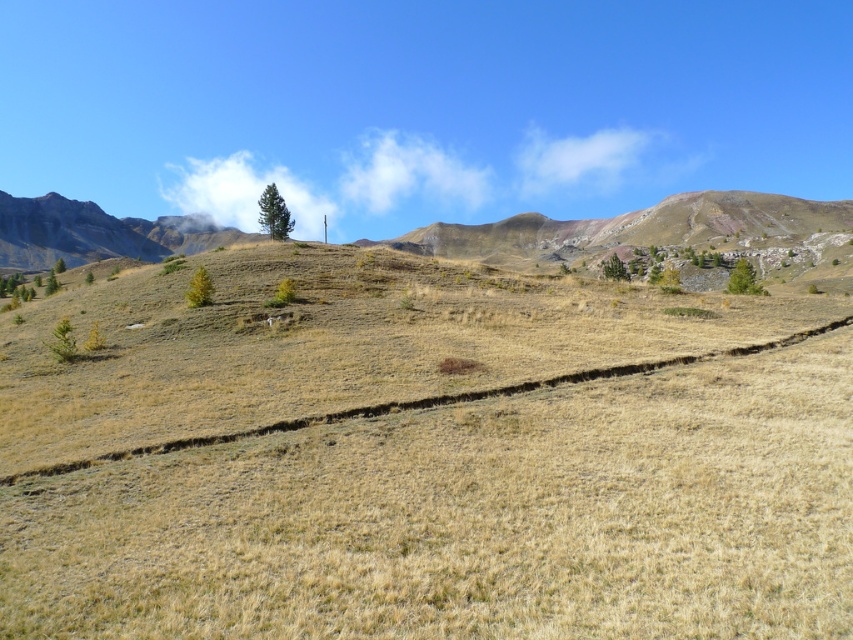
Is rustic brown mountain at center below green textured tree at right?

Incorrect, rustic brown mountain at center is not positioned below green textured tree at right.

Based on the photo, who is shorter, rustic brown mountain at center or green textured tree at right?

green textured tree at right

The width and height of the screenshot is (853, 640). Identify the location of rustic brown mountain at center. (657, 234).

Looking at this image, who is higher up, rugged stone mountain at upper left or green matte tree at lower left?

rugged stone mountain at upper left

Is rugged stone mountain at upper left thinner than green matte tree at lower left?

In fact, rugged stone mountain at upper left might be wider than green matte tree at lower left.

Which is behind, point (50, 220) or point (202, 266)?

Point (50, 220)

Where is `rugged stone mountain at upper left`? This screenshot has height=640, width=853. rugged stone mountain at upper left is located at coordinates (97, 234).

Which is more to the right, rugged stone mountain at upper left or green matte tree at center?

green matte tree at center

Between point (212, 221) and point (274, 227), which one is positioned behind?

The point (212, 221) is more distant.

Where is `rugged stone mountain at upper left`? The height and width of the screenshot is (640, 853). rugged stone mountain at upper left is located at coordinates (97, 234).